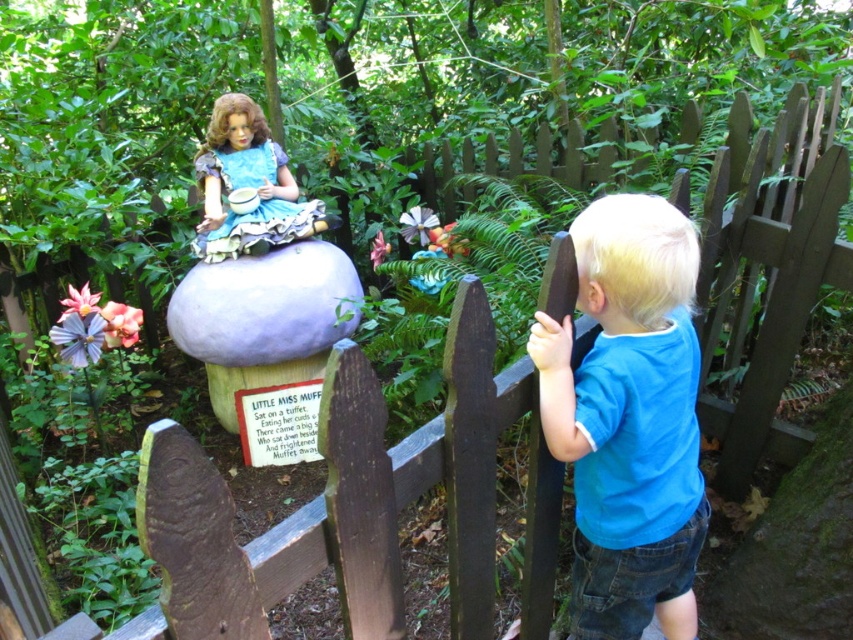
Question: Which point is farther to the camera?

Choices:
 (A) (256, 193)
 (B) (639, 336)

Answer: (A)

Question: Considering the relative positions of blue cotton shirt at right and matte blue fabric doll at upper center in the image provided, where is blue cotton shirt at right located with respect to matte blue fabric doll at upper center?

Choices:
 (A) above
 (B) below

Answer: (B)

Question: Is the position of blue cotton shirt at right more distant than that of matte blue fabric doll at upper center?

Choices:
 (A) no
 (B) yes

Answer: (A)

Question: Which point is closer to the camera?

Choices:
 (A) matte blue fabric doll at upper center
 (B) blue cotton shirt at right

Answer: (B)

Question: Can you confirm if blue cotton shirt at right is bigger than matte blue fabric doll at upper center?

Choices:
 (A) yes
 (B) no

Answer: (A)